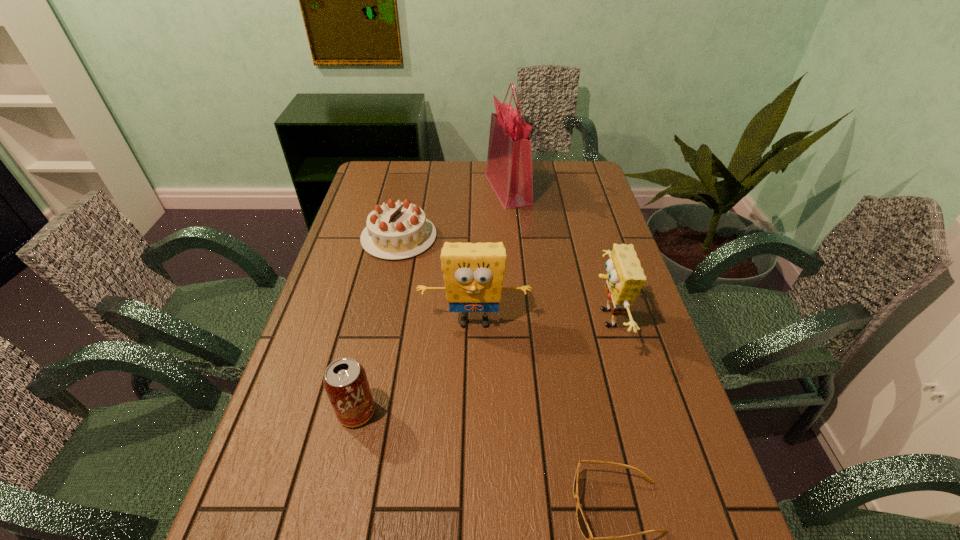
What are the coordinates of `vacant space at the left edge of the desktop` in the screenshot? It's located at (354, 323).

This screenshot has height=540, width=960. What are the coordinates of `vacant space at the right edge of the desktop` in the screenshot? It's located at (602, 321).

Locate an element on the screen. free space at the far left corner of the desktop is located at coordinates (389, 184).

Identify the location of vacant space in between the left sponge and the second shortest object. This screenshot has height=540, width=960. (437, 279).

The width and height of the screenshot is (960, 540). Find the location of `vacant area that lies between the fifth farthest object and the birthday cake`. vacant area that lies between the fifth farthest object and the birthday cake is located at coordinates (377, 325).

Find the location of a particular element. The width and height of the screenshot is (960, 540). unoccupied position between the right sponge and the left sponge is located at coordinates (540, 320).

Image resolution: width=960 pixels, height=540 pixels. What are the coordinates of `vacant area that lies between the fourth tallest object and the right sponge` in the screenshot? It's located at (481, 366).

The image size is (960, 540). Find the location of `empty location between the fifth farthest object and the left sponge`. empty location between the fifth farthest object and the left sponge is located at coordinates (416, 367).

Identify the location of empty space that is in between the third shortest object and the fifth tallest object. (377, 325).

Where is `free area in between the left sponge and the soda can`? The width and height of the screenshot is (960, 540). free area in between the left sponge and the soda can is located at coordinates (416, 367).